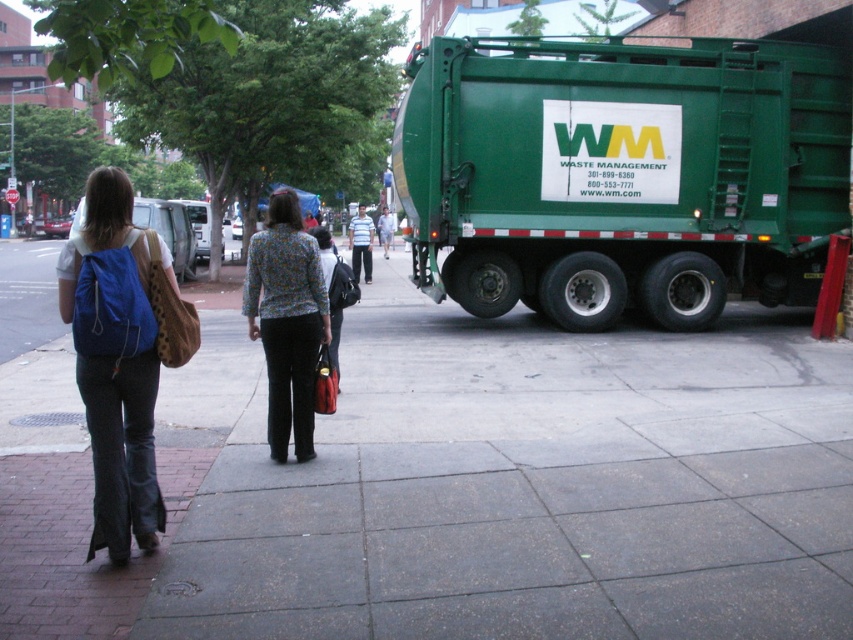
Between floral-patterned blouse at center and striped cotton shirt at center, which one is positioned lower?

floral-patterned blouse at center

The height and width of the screenshot is (640, 853). What do you see at coordinates (286, 321) in the screenshot? I see `floral-patterned blouse at center` at bounding box center [286, 321].

At what (x,y) coordinates should I click in order to perform the action: click on floral-patterned blouse at center. Please return your answer as a coordinate pair (x, y). This screenshot has height=640, width=853. Looking at the image, I should click on (286, 321).

Is blue fabric backpack at left bigger than floral-patterned blouse at center?

Correct, blue fabric backpack at left is larger in size than floral-patterned blouse at center.

Is point (77, 282) farther from viewer compared to point (283, 300)?

No, (77, 282) is closer to viewer.

Is point (91, 208) farther from viewer compared to point (283, 333)?

No, it is in front of (283, 333).

The width and height of the screenshot is (853, 640). I want to click on blue fabric backpack at left, so click(x=115, y=362).

Does green matte truck at right appear on the left side of blue fabric backpack at left?

No, green matte truck at right is not to the left of blue fabric backpack at left.

The image size is (853, 640). What do you see at coordinates (622, 173) in the screenshot?
I see `green matte truck at right` at bounding box center [622, 173].

Which is behind, point (637, 49) or point (106, 225)?

Point (637, 49)

Where is `green matte truck at right`? This screenshot has width=853, height=640. green matte truck at right is located at coordinates (622, 173).